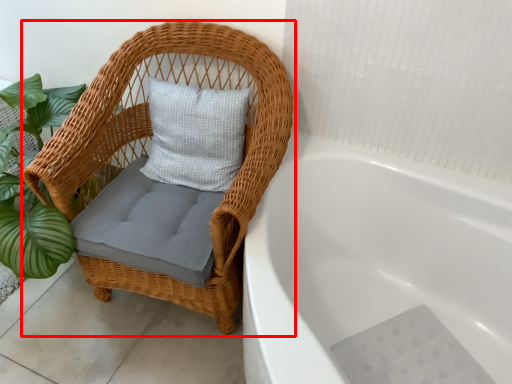
Question: From the image's perspective, where is chair (annotated by the red box) located in relation to bathtub in the image?

Choices:
 (A) above
 (B) below

Answer: (A)